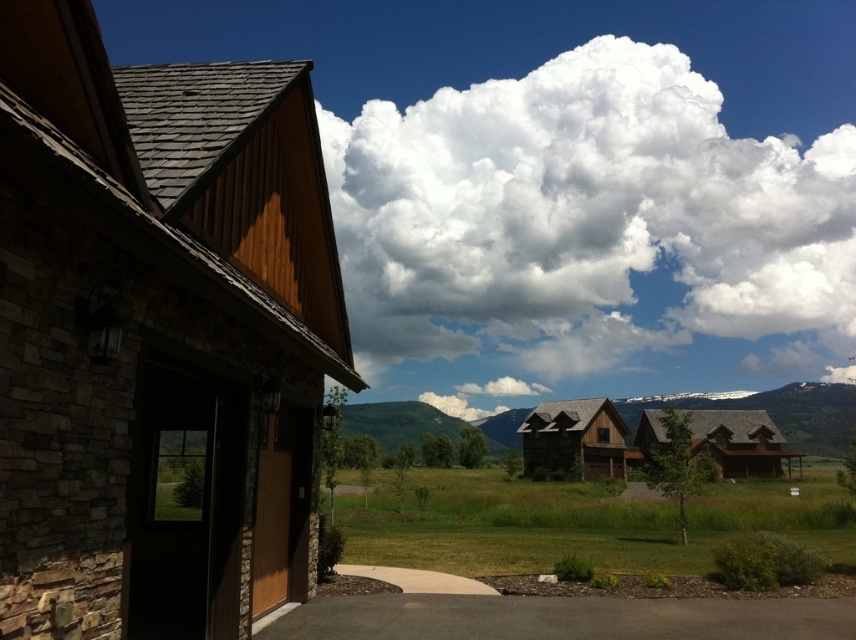
Who is more forward, (458, 440) or (415, 573)?

Point (415, 573) is more forward.

Does green grassy hill at center appear on the left side of smooth concrete driveway at lower center?

Indeed, green grassy hill at center is positioned on the left side of smooth concrete driveway at lower center.

Is point (360, 426) less distant than point (444, 579)?

No, (360, 426) is behind (444, 579).

Find the location of a particular element. The width and height of the screenshot is (856, 640). green grassy hill at center is located at coordinates (397, 422).

Between wooden cabin at center and green grassy hill at center, which one appears on the right side from the viewer's perspective?

Positioned to the right is wooden cabin at center.

Locate an element on the screen. The width and height of the screenshot is (856, 640). wooden cabin at center is located at coordinates 797,413.

Can you confirm if white fluffy cloud at upper center is shorter than green grassy hill at center?

Incorrect, white fluffy cloud at upper center's height does not fall short of green grassy hill at center's.

Who is more forward, (x=419, y=321) or (x=385, y=410)?

Point (x=385, y=410) is more forward.

The image size is (856, 640). In order to click on white fluffy cloud at upper center in this screenshot , I will do `click(587, 234)`.